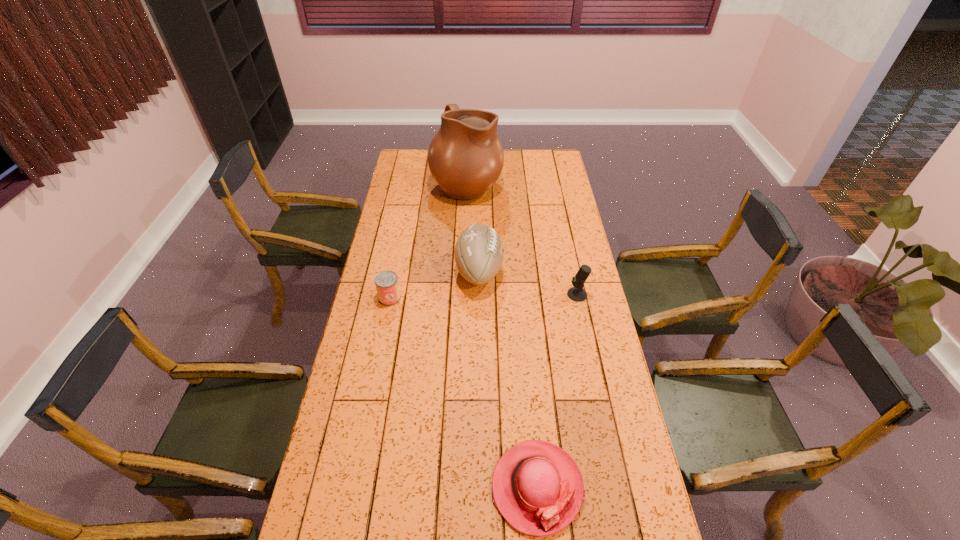
Find the location of a particular element. This screenshot has height=540, width=960. free space located on the front of the leftmost object is located at coordinates (374, 375).

This screenshot has width=960, height=540. I want to click on object that is at the far edge, so click(465, 157).

I want to click on object that is positioned at the left edge, so click(x=386, y=282).

Image resolution: width=960 pixels, height=540 pixels. What are the coordinates of `microphone at the right edge` in the screenshot? It's located at (577, 293).

This screenshot has width=960, height=540. What are the coordinates of `hat present at the right edge` in the screenshot? It's located at (537, 487).

Identify the location of vacant space at the left edge of the desktop. (383, 382).

Locate an element on the screen. The image size is (960, 540). vacant region at the right edge is located at coordinates (545, 201).

The image size is (960, 540). In the image, there is a desktop. Identify the location of vacant space at the far right corner. (549, 161).

In order to click on vacant area that lies between the football (American) and the can in this screenshot , I will do `click(435, 285)`.

Find the location of a particular element. vacant area that lies between the nearest object and the fourth shortest object is located at coordinates (508, 379).